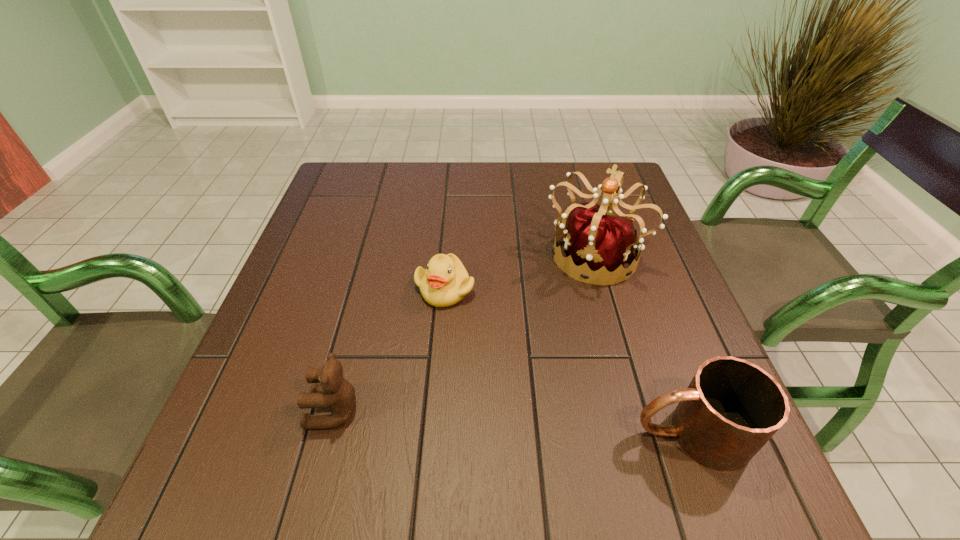
Identify which object is the closest to the tallest object. Please provide its 2D coordinates. Your answer should be formatted as a tuple, i.e. [(x, y)], where the tuple contains the x and y coordinates of a point satisfying the conditions above.

[(445, 282)]

Point out which object is positioned as the second nearest to the duckling. Please provide its 2D coordinates. Your answer should be formatted as a tuple, i.e. [(x, y)], where the tuple contains the x and y coordinates of a point satisfying the conditions above.

[(335, 392)]

Locate an element on the screen. Image resolution: width=960 pixels, height=540 pixels. free space that satisfies the following two spatial constraints: 1. on the front side of the mug; 2. on the side of the tiara with the handle is located at coordinates [x=644, y=434].